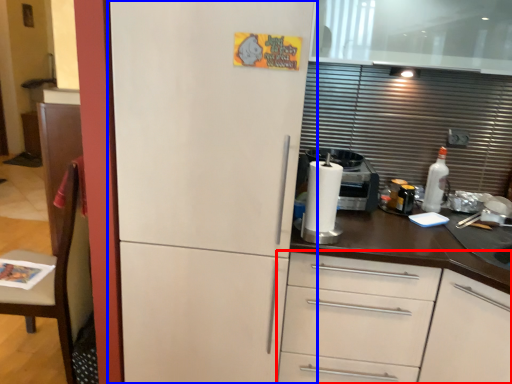
Question: Which point is closer to the camera, cabinetry (highlighted by a red box) or refrigerator (highlighted by a blue box)?

Choices:
 (A) cabinetry
 (B) refrigerator

Answer: (B)